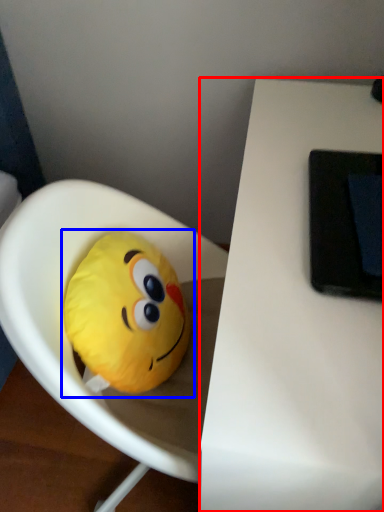
Question: Which point is further to the camera, table (highlighted by a red box) or toy (highlighted by a blue box)?

Choices:
 (A) table
 (B) toy

Answer: (B)